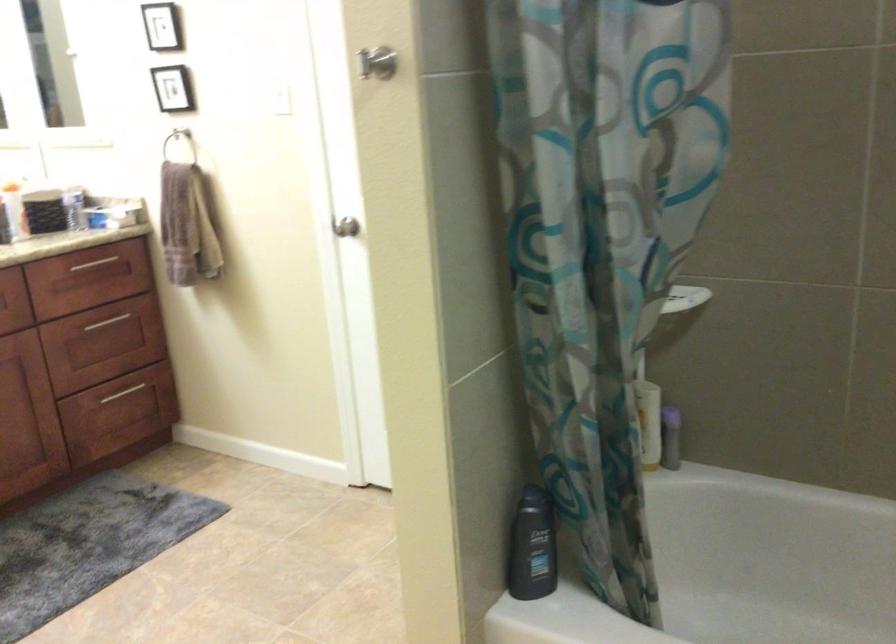
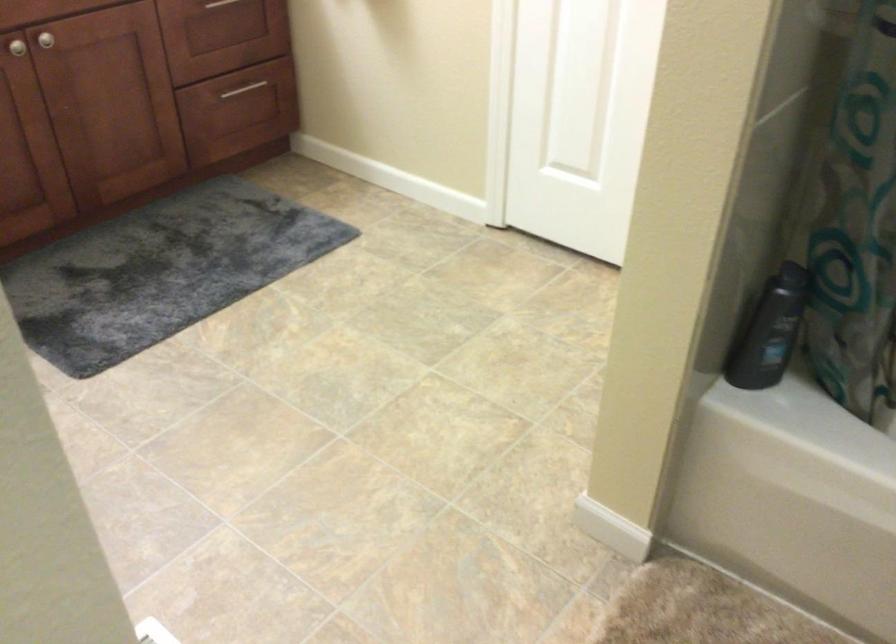
Question: The images are taken continuously from a first-person perspective. In which direction is your viewpoint rotating?

Choices:
 (A) Left
 (B) Right
 (C) Up
 (D) Down

Answer: (D)